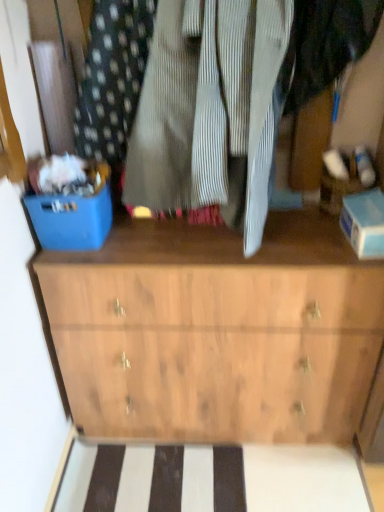
Describe the element at coordinates (217, 332) in the screenshot. I see `wooden chest of drawers at center` at that location.

In order to click on wooden chest of drawers at center in this screenshot , I will do `click(217, 332)`.

I want to click on blue plastic bin at left, so coord(71,220).

Describe the element at coordinates (71, 220) in the screenshot. I see `blue plastic bin at left` at that location.

Where is `wooden chest of drawers at center`? This screenshot has width=384, height=512. wooden chest of drawers at center is located at coordinates (217, 332).

Can you confirm if wooden chest of drawers at center is positioned to the left of blue plastic bin at left?

In fact, wooden chest of drawers at center is to the right of blue plastic bin at left.

Which object is further away from the camera taking this photo, wooden chest of drawers at center or blue plastic bin at left?

wooden chest of drawers at center is further from the camera.

Is point (223, 402) less distant than point (91, 204)?

That is False.

From the image's perspective, is wooden chest of drawers at center above or below blue plastic bin at left?

Clearly, from the image's perspective, wooden chest of drawers at center is below blue plastic bin at left.

From a real-world perspective, is wooden chest of drawers at center located beneath blue plastic bin at left?

Yes, from a real-world perspective, wooden chest of drawers at center is below blue plastic bin at left.

Can you confirm if wooden chest of drawers at center is thinner than blue plastic bin at left?

In fact, wooden chest of drawers at center might be wider than blue plastic bin at left.

Does wooden chest of drawers at center have a lesser height compared to blue plastic bin at left?

No.

In terms of size, does wooden chest of drawers at center appear bigger or smaller than blue plastic bin at left?

In the image, wooden chest of drawers at center appears to be larger than blue plastic bin at left.

Is blue plastic bin at left located within wooden chest of drawers at center?

Definitely not — blue plastic bin at left is not inside wooden chest of drawers at center.

Is wooden chest of drawers at center in contact with blue plastic bin at left?

No, wooden chest of drawers at center is not touching blue plastic bin at left.

Is wooden chest of drawers at center oriented away from blue plastic bin at left?

No, wooden chest of drawers at center's orientation is not away from blue plastic bin at left.

What's the angular difference between wooden chest of drawers at center and blue plastic bin at left's facing directions?

The facing directions of wooden chest of drawers at center and blue plastic bin at left are 0.000439 degrees apart.

The width and height of the screenshot is (384, 512). Identify the location of chest of drawers that appears on the right of blue plastic bin at left. (x=217, y=332).

Is blue plastic bin at left at the right side of wooden chest of drawers at center?

No.

Which is behind, blue plastic bin at left or wooden chest of drawers at center?

wooden chest of drawers at center is further from the camera.

Which is closer to the camera, (x=71, y=225) or (x=257, y=381)?

Point (x=71, y=225).

From the picture: From the image's perspective, is blue plastic bin at left located above or below wooden chest of drawers at center?

blue plastic bin at left is above wooden chest of drawers at center.

From a real-world perspective, which is physically above, blue plastic bin at left or wooden chest of drawers at center?

blue plastic bin at left is physically above.

Considering the sizes of objects blue plastic bin at left and wooden chest of drawers at center in the image provided, who is thinner, blue plastic bin at left or wooden chest of drawers at center?

blue plastic bin at left.

Between blue plastic bin at left and wooden chest of drawers at center, which one has less height?

blue plastic bin at left.

Can you confirm if blue plastic bin at left is bigger than wooden chest of drawers at center?

Incorrect, blue plastic bin at left is not larger than wooden chest of drawers at center.

Can we say blue plastic bin at left lies outside wooden chest of drawers at center?

Absolutely, blue plastic bin at left is external to wooden chest of drawers at center.

Is blue plastic bin at left placed right next to wooden chest of drawers at center?

There is a gap between blue plastic bin at left and wooden chest of drawers at center.

Is blue plastic bin at left oriented towards wooden chest of drawers at center?

No, blue plastic bin at left is not turned towards wooden chest of drawers at center.

Looking at this image, can you tell me how much blue plastic bin at left and wooden chest of drawers at center differ in facing direction?

There is a 0.000439-degree angle between the facing directions of blue plastic bin at left and wooden chest of drawers at center.

This screenshot has height=512, width=384. Identify the location of chest of drawers behind the blue plastic bin at left. (217, 332).

Where is `chest of drawers below the blue plastic bin at left (from a real-world perspective)`? This screenshot has height=512, width=384. chest of drawers below the blue plastic bin at left (from a real-world perspective) is located at coordinates (217, 332).

Where is `the chest of drawers behind the blue plastic bin at left`? This screenshot has height=512, width=384. the chest of drawers behind the blue plastic bin at left is located at coordinates coord(217,332).